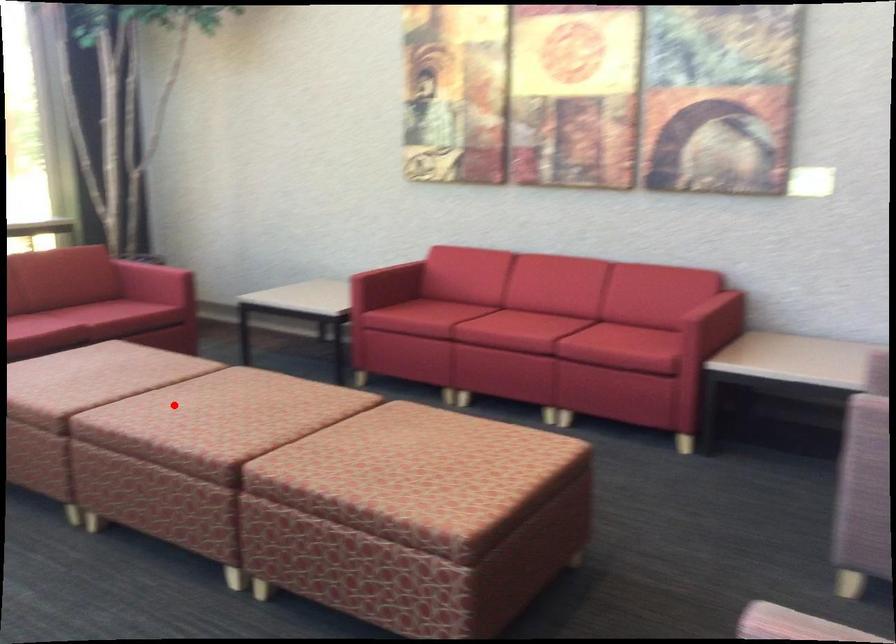
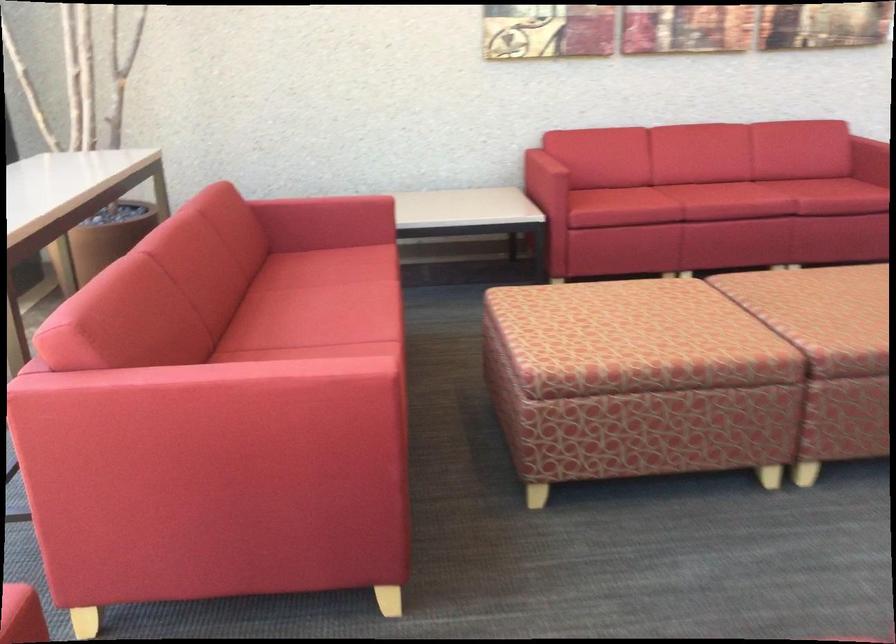
Locate, in the second image, the point that corresponds to the highlighted location in the first image.

(834, 317)